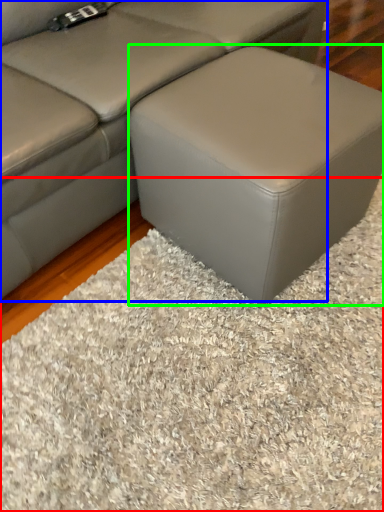
Question: Which object is the farthest from mat (highlighted by a red box)? Choose among these: studio couch (highlighted by a blue box) or stool (highlighted by a green box).

Choices:
 (A) studio couch
 (B) stool

Answer: (A)